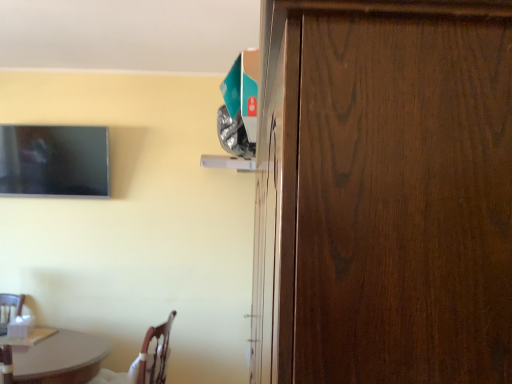
Question: Considering the relative sizes of matte black tv at upper left and dark wood door at right in the image provided, is matte black tv at upper left shorter than dark wood door at right?

Choices:
 (A) no
 (B) yes

Answer: (B)

Question: Can you confirm if matte black tv at upper left is thinner than dark wood door at right?

Choices:
 (A) yes
 (B) no

Answer: (A)

Question: Is matte black tv at upper left at the right side of dark wood door at right?

Choices:
 (A) yes
 (B) no

Answer: (B)

Question: Is matte black tv at upper left further to camera compared to dark wood door at right?

Choices:
 (A) yes
 (B) no

Answer: (A)

Question: From a real-world perspective, is matte black tv at upper left physically above dark wood door at right?

Choices:
 (A) no
 (B) yes

Answer: (B)

Question: From a real-world perspective, is matte black tv at upper left above or below dark wood door at right?

Choices:
 (A) above
 (B) below

Answer: (A)

Question: Would you say matte black tv at upper left is to the left or to the right of dark wood door at right in the picture?

Choices:
 (A) left
 (B) right

Answer: (A)

Question: Is matte black tv at upper left spatially inside dark wood door at right, or outside of it?

Choices:
 (A) outside
 (B) inside

Answer: (A)

Question: In terms of size, does matte black tv at upper left appear bigger or smaller than dark wood door at right?

Choices:
 (A) big
 (B) small

Answer: (B)

Question: Choose the correct answer: Is matte black tv at upper left inside wooden chair at lower left or outside it?

Choices:
 (A) outside
 (B) inside

Answer: (A)

Question: Looking at their shapes, would you say matte black tv at upper left is wider or thinner than wooden chair at lower left?

Choices:
 (A) thin
 (B) wide

Answer: (A)

Question: Considering their positions, is matte black tv at upper left located in front of or behind wooden chair at lower left?

Choices:
 (A) front
 (B) behind

Answer: (B)

Question: Is point (93, 195) closer or farther from the camera than point (150, 362)?

Choices:
 (A) closer
 (B) farther

Answer: (B)

Question: Relative to wooden chair at lower left, is dark wood door at right in front or behind?

Choices:
 (A) front
 (B) behind

Answer: (A)

Question: Looking at their shapes, would you say dark wood door at right is wider or thinner than wooden chair at lower left?

Choices:
 (A) thin
 (B) wide

Answer: (B)